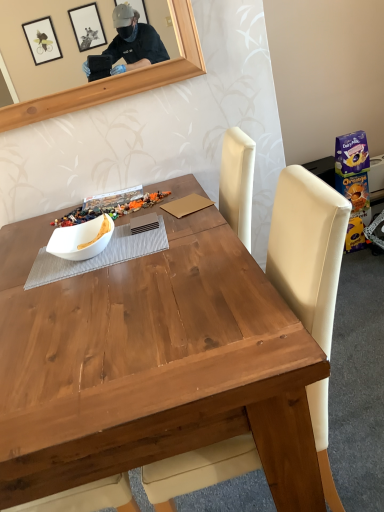
In order to click on free location in front of white matte bowl at center in this screenshot , I will do `click(91, 280)`.